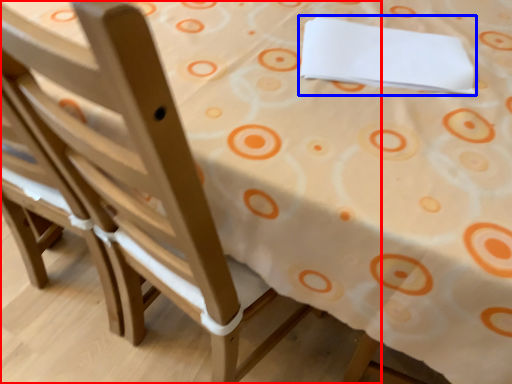
Question: Which point is further to the camera, chair (highlighted by a red box) or linen (highlighted by a blue box)?

Choices:
 (A) chair
 (B) linen

Answer: (B)